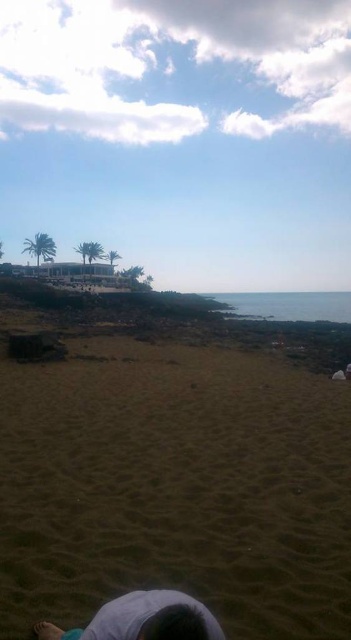
Question: Which of the following is the closest to the observer?

Choices:
 (A) light blue fabric at lower center
 (B) brown sandy beach at lower center

Answer: (A)

Question: Where is brown sandy beach at lower center located in relation to light blue fabric at lower center in the image?

Choices:
 (A) below
 (B) above

Answer: (A)

Question: Does brown sandy beach at lower center have a larger size compared to light blue fabric at lower center?

Choices:
 (A) yes
 (B) no

Answer: (A)

Question: Is brown sandy beach at lower center thinner than light blue fabric at lower center?

Choices:
 (A) no
 (B) yes

Answer: (A)